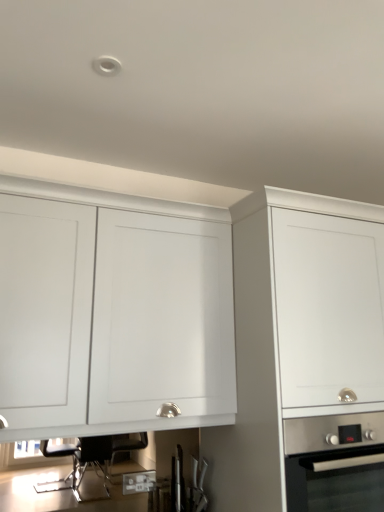
Question: Is white matte cabinet at upper left, which ranks as the 2th cabinetry in right-to-left order, smaller than white matte cabinet at center, which ranks as the 1th cabinetry in right-to-left order?

Choices:
 (A) no
 (B) yes

Answer: (B)

Question: Could white matte cabinet at center, positioned as the 2th cabinetry in left-to-right order, be considered to be inside white matte cabinet at upper left, the first cabinetry viewed from the left?

Choices:
 (A) no
 (B) yes

Answer: (A)

Question: Is white matte cabinet at upper left, the first cabinetry viewed from the left, wider than white matte cabinet at center, which ranks as the 1th cabinetry in right-to-left order?

Choices:
 (A) no
 (B) yes

Answer: (A)

Question: Considering the relative sizes of white matte cabinet at upper left, which ranks as the 2th cabinetry in right-to-left order, and white matte cabinet at center, which ranks as the 1th cabinetry in right-to-left order, in the image provided, is white matte cabinet at upper left, which ranks as the 2th cabinetry in right-to-left order, taller than white matte cabinet at center, which ranks as the 1th cabinetry in right-to-left order,?

Choices:
 (A) no
 (B) yes

Answer: (A)

Question: From a real-world perspective, is white matte cabinet at upper left, which ranks as the 2th cabinetry in right-to-left order, over white matte cabinet at center, which ranks as the 1th cabinetry in right-to-left order?

Choices:
 (A) yes
 (B) no

Answer: (A)

Question: Can you confirm if white matte cabinet at upper left, which ranks as the 2th cabinetry in right-to-left order, is bigger than white matte cabinet at center, which ranks as the 1th cabinetry in right-to-left order?

Choices:
 (A) yes
 (B) no

Answer: (B)

Question: From the image's perspective, would you say white matte cabinet at upper left, which ranks as the 2th cabinetry in right-to-left order, is positioned over stainless steel oven at lower right?

Choices:
 (A) yes
 (B) no

Answer: (A)

Question: Considering the relative sizes of white matte cabinet at upper left, the first cabinetry viewed from the left, and stainless steel oven at lower right in the image provided, is white matte cabinet at upper left, the first cabinetry viewed from the left, shorter than stainless steel oven at lower right?

Choices:
 (A) yes
 (B) no

Answer: (B)

Question: From a real-world perspective, is white matte cabinet at upper left, which ranks as the 2th cabinetry in right-to-left order, on top of stainless steel oven at lower right?

Choices:
 (A) yes
 (B) no

Answer: (A)

Question: Considering the relative sizes of white matte cabinet at upper left, which ranks as the 2th cabinetry in right-to-left order, and stainless steel oven at lower right in the image provided, is white matte cabinet at upper left, which ranks as the 2th cabinetry in right-to-left order, thinner than stainless steel oven at lower right?

Choices:
 (A) yes
 (B) no

Answer: (A)

Question: Considering the relative sizes of white matte cabinet at upper left, the first cabinetry viewed from the left, and stainless steel oven at lower right in the image provided, is white matte cabinet at upper left, the first cabinetry viewed from the left, bigger than stainless steel oven at lower right?

Choices:
 (A) no
 (B) yes

Answer: (B)

Question: Does white matte cabinet at upper left, which ranks as the 2th cabinetry in right-to-left order, come in front of stainless steel oven at lower right?

Choices:
 (A) no
 (B) yes

Answer: (B)

Question: Does white matte cabinet at center, which ranks as the 1th cabinetry in right-to-left order, have a lesser width compared to stainless steel oven at lower right?

Choices:
 (A) no
 (B) yes

Answer: (A)